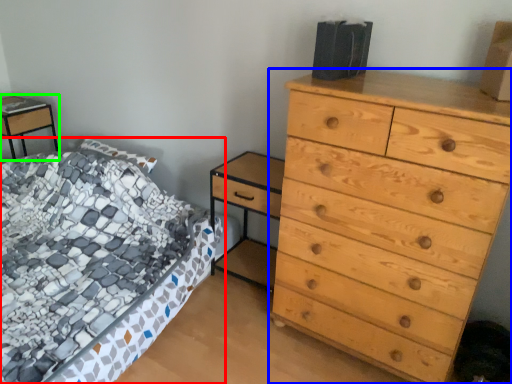
Question: Which is farther away from bed (highlighted by a red box)? chest of drawers (highlighted by a blue box) or nightstand (highlighted by a green box)?

Choices:
 (A) chest of drawers
 (B) nightstand

Answer: (B)